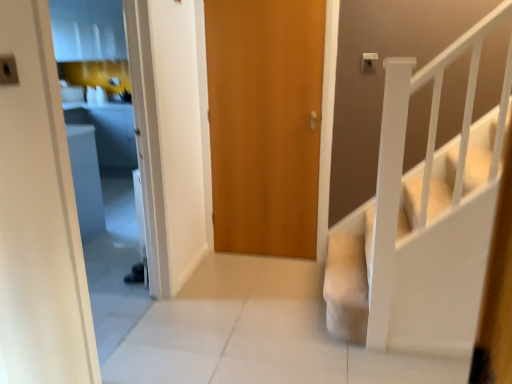
Question: From a real-world perspective, is white painted wood stairs at right on top of wooden door at center?

Choices:
 (A) no
 (B) yes

Answer: (A)

Question: Could wooden door at center be considered to be inside white painted wood stairs at right?

Choices:
 (A) no
 (B) yes

Answer: (A)

Question: Is white painted wood stairs at right at the right side of wooden door at center?

Choices:
 (A) yes
 (B) no

Answer: (A)

Question: Is white painted wood stairs at right to the left of wooden door at center from the viewer's perspective?

Choices:
 (A) yes
 (B) no

Answer: (B)

Question: Can you see white painted wood stairs at right touching wooden door at center?

Choices:
 (A) no
 (B) yes

Answer: (A)

Question: Can you confirm if white painted wood stairs at right is wider than wooden door at center?

Choices:
 (A) yes
 (B) no

Answer: (A)

Question: From a real-world perspective, is wooden door at center below white painted wood stairs at right?

Choices:
 (A) yes
 (B) no

Answer: (B)

Question: Considering the relative positions of wooden door at center and white painted wood stairs at right in the image provided, is wooden door at center to the right of white painted wood stairs at right from the viewer's perspective?

Choices:
 (A) yes
 (B) no

Answer: (B)

Question: Is wooden door at center behind white painted wood stairs at right?

Choices:
 (A) yes
 (B) no

Answer: (A)

Question: Are wooden door at center and white painted wood stairs at right making contact?

Choices:
 (A) yes
 (B) no

Answer: (B)

Question: From the image's perspective, is wooden door at center beneath white painted wood stairs at right?

Choices:
 (A) yes
 (B) no

Answer: (B)

Question: Considering the relative sizes of wooden door at center and white painted wood stairs at right in the image provided, is wooden door at center bigger than white painted wood stairs at right?

Choices:
 (A) no
 (B) yes

Answer: (A)

Question: From the image's perspective, is white painted wood stairs at right positioned above or below wooden door at center?

Choices:
 (A) below
 (B) above

Answer: (A)